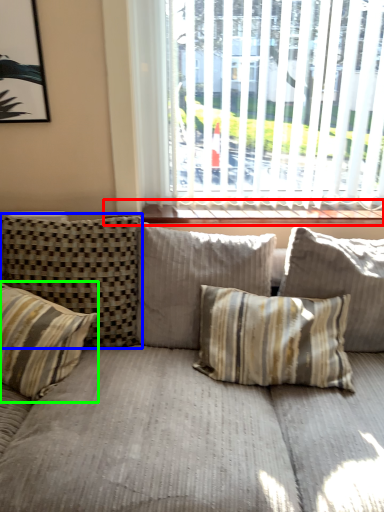
Question: Which is nearer to the window sill (highlighted by a red box)? pillow (highlighted by a blue box) or pillow (highlighted by a green box).

Choices:
 (A) pillow
 (B) pillow

Answer: (A)